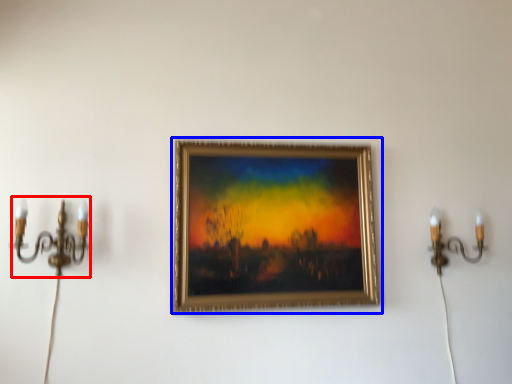
Question: Which of the following is the farthest to the observer, candle holder (highlighted by a red box) or picture frame (highlighted by a blue box)?

Choices:
 (A) candle holder
 (B) picture frame

Answer: (B)